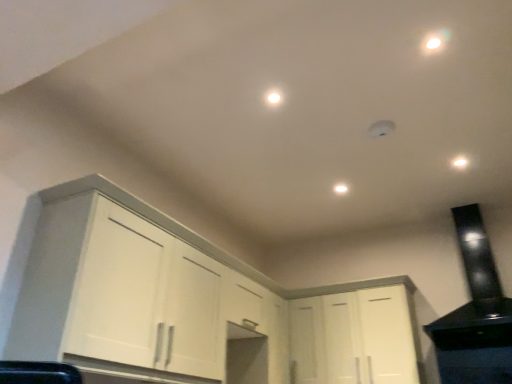
Question: Can you confirm if white matte cabinet at center, acting as the 1th cabinetry starting from the right, is taller than white matte light fixture at center, the 2th dot when ordered from left to right?

Choices:
 (A) no
 (B) yes

Answer: (B)

Question: From the image's perspective, is white matte cabinet at center, which is counted as the second cabinetry, starting from the left, beneath white matte light fixture at center, arranged as the 2th dot when viewed from the front?

Choices:
 (A) yes
 (B) no

Answer: (A)

Question: Is white matte cabinet at center, acting as the 1th cabinetry starting from the right, at the left side of white matte light fixture at center, the 1th dot in the right-to-left sequence?

Choices:
 (A) yes
 (B) no

Answer: (B)

Question: From the image's perspective, does white matte cabinet at center, which is counted as the second cabinetry, starting from the left, appear higher than white matte light fixture at center, which ranks as the 2th dot in top-to-bottom order?

Choices:
 (A) yes
 (B) no

Answer: (B)

Question: Is white matte cabinet at center, which is counted as the second cabinetry, starting from the left, positioned in front of white matte light fixture at center, acting as the 1th dot starting from the back?

Choices:
 (A) yes
 (B) no

Answer: (A)

Question: From the image's perspective, is white matte cabinet at left, positioned as the first cabinetry in left-to-right order, positioned above or below white matte cabinet at center, acting as the 1th cabinetry starting from the right?

Choices:
 (A) above
 (B) below

Answer: (A)

Question: Is white matte cabinet at left, acting as the second cabinetry starting from the right, wider or thinner than white matte cabinet at center, which is counted as the second cabinetry, starting from the left?

Choices:
 (A) thin
 (B) wide

Answer: (B)

Question: Based on their positions, is white matte cabinet at left, positioned as the first cabinetry in left-to-right order, located to the left or right of white matte cabinet at center, which is counted as the second cabinetry, starting from the left?

Choices:
 (A) left
 (B) right

Answer: (A)

Question: Considering the positions of point (130, 223) and point (316, 347), is point (130, 223) closer or farther from the camera than point (316, 347)?

Choices:
 (A) closer
 (B) farther

Answer: (A)

Question: From the image's perspective, is white glossy light at center, which appears as the 1th dot when viewed from the front, located above or below white matte cabinet at center, acting as the 1th cabinetry starting from the right?

Choices:
 (A) below
 (B) above

Answer: (B)

Question: Considering the positions of white glossy light at center, the first dot viewed from the top, and white matte cabinet at center, which is counted as the second cabinetry, starting from the left, in the image, is white glossy light at center, the first dot viewed from the top, taller or shorter than white matte cabinet at center, which is counted as the second cabinetry, starting from the left,?

Choices:
 (A) tall
 (B) short

Answer: (B)

Question: In terms of size, does white glossy light at center, which is the 2th dot from bottom to top, appear bigger or smaller than white matte cabinet at center, which is counted as the second cabinetry, starting from the left?

Choices:
 (A) big
 (B) small

Answer: (B)

Question: Is white glossy light at center, which is counted as the first dot, starting from the left, to the left or to the right of white matte cabinet at center, which is counted as the second cabinetry, starting from the left, in the image?

Choices:
 (A) left
 (B) right

Answer: (A)

Question: From a real-world perspective, is white matte cabinet at center, acting as the 1th cabinetry starting from the right, positioned above or below white matte light fixture at center, arranged as the 2th dot when viewed from the front?

Choices:
 (A) below
 (B) above

Answer: (A)

Question: From the image's perspective, is white matte cabinet at center, acting as the 1th cabinetry starting from the right, located above or below white matte light fixture at center, arranged as the 2th dot when viewed from the front?

Choices:
 (A) above
 (B) below

Answer: (B)